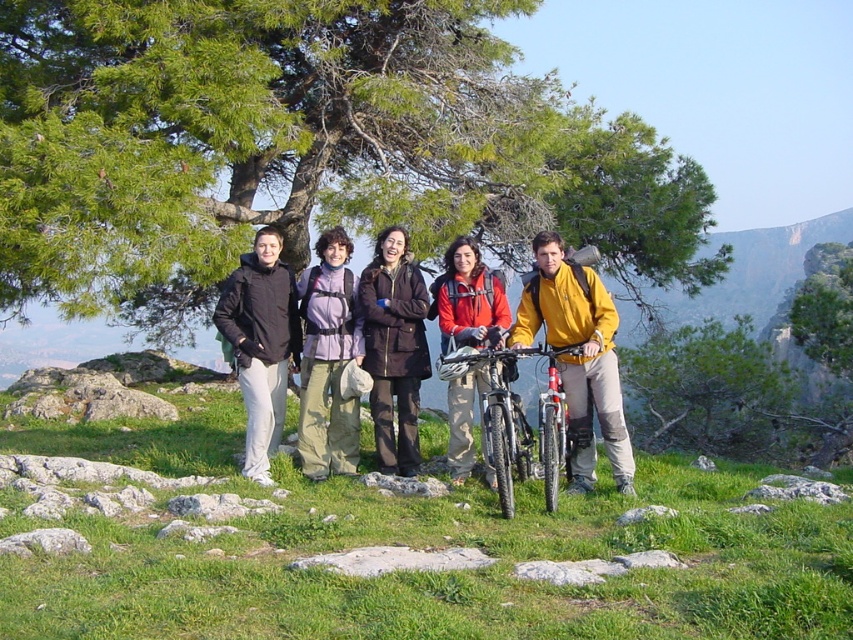
You are standing on the grassy hillside and want to take a photo of the green leafy tree at upper center and the green grassy at center. Which object should you position to the left side of your camera frame?

You should position the green leafy tree at upper center to the left side of your camera frame since it is already to the left of the green grassy at center in the scene.

You are planning to take a photo of the black matte mountain bike at center. The photographer has set up a tripod at point A located at coordinates (521, 420). Where should you position the black matte mountain bike at center so that it aligns perfectly with the tripod?

The black matte mountain bike at center should be positioned exactly at point A, which is marked by the coordinates (521, 420), to align perfectly with the tripod.

You are standing at the base of the grassy hillside and want to walk towards the two points marked in the image. Which point, point (595, 349) or point (347, 282), will you reach first?

Point (595, 349) is in front of point (347, 282), so you will reach point (595, 349) first.